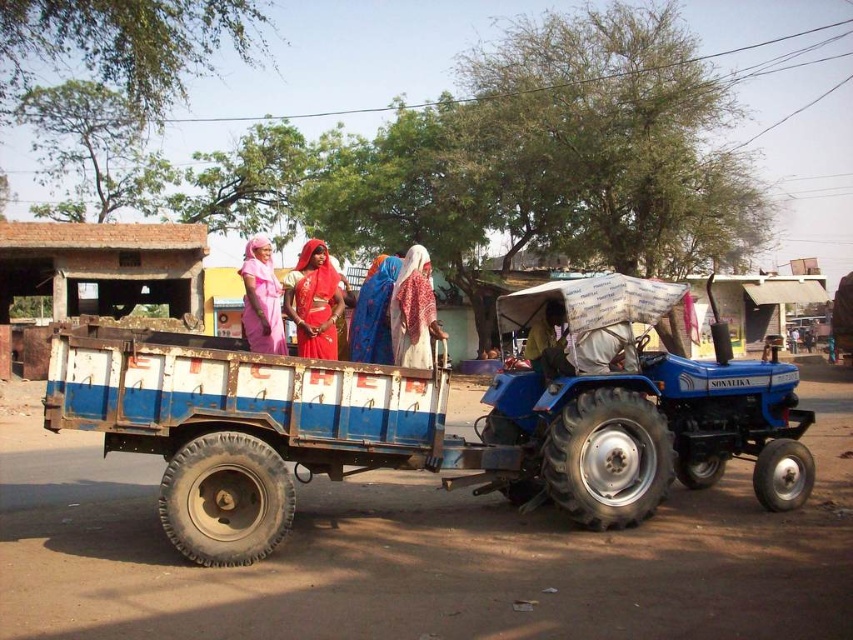
Does point (259, 340) lie in front of point (386, 305)?

No, (259, 340) is further to viewer.

Who is more forward, (x=265, y=276) or (x=374, y=346)?

Point (x=374, y=346) is more forward.

I want to click on matte pink dress at center, so click(260, 298).

Is point (341, 301) positioned before point (368, 289)?

Yes, point (341, 301) is closer to viewer.

At what (x,y) coordinates should I click in order to perform the action: click on matte red sari at center. Please return your answer as a coordinate pair (x, y). Image resolution: width=853 pixels, height=640 pixels. Looking at the image, I should click on click(314, 301).

Where is `matte red sari at center`? This screenshot has height=640, width=853. matte red sari at center is located at coordinates (314, 301).

Is point (735, 401) less distant than point (264, 237)?

No.

Which is more to the left, blue metallic tractor at center or matte pink dress at center?

Positioned to the left is matte pink dress at center.

Between point (743, 429) and point (248, 250), which one is positioned behind?

Positioned behind is point (743, 429).

Identify the location of blue metallic tractor at center. The height and width of the screenshot is (640, 853). (416, 429).